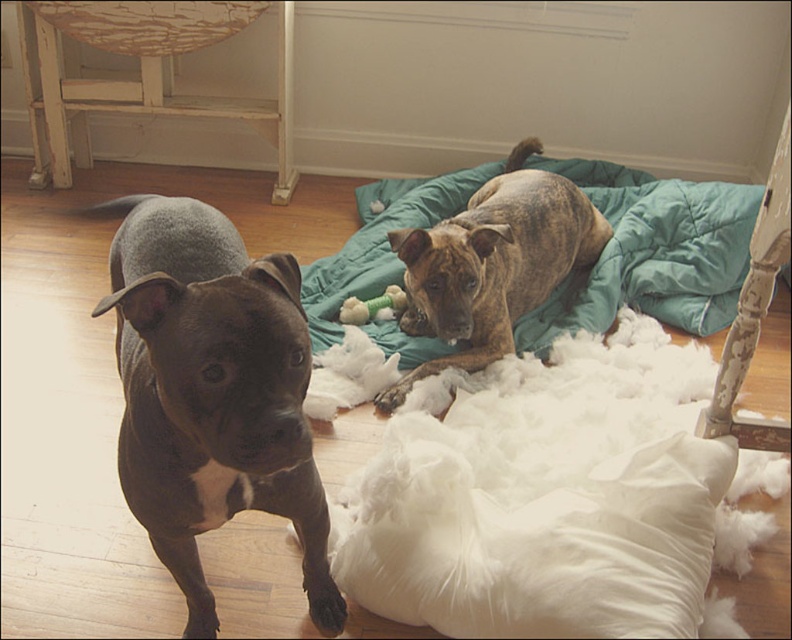
You are a photographer setting up a shoot in this room. You need to ensure that both the teal quilted blanket at upper right and the brown brindle dog at upper center are fully visible in the frame. Given their positions and sizes, will you need to adjust your camera angle to accommodate both?

The teal quilted blanket at upper right is much taller than the brown brindle dog at upper center. To ensure both are fully visible, you may need to adjust your camera angle to account for the height difference between the teal quilted blanket at upper right and the brown brindle dog at upper center.

What is the 2D coordinate of the teal quilted blanket at upper right in the image?

The teal quilted blanket at upper right is located at the 2D coordinate point of [650,253].